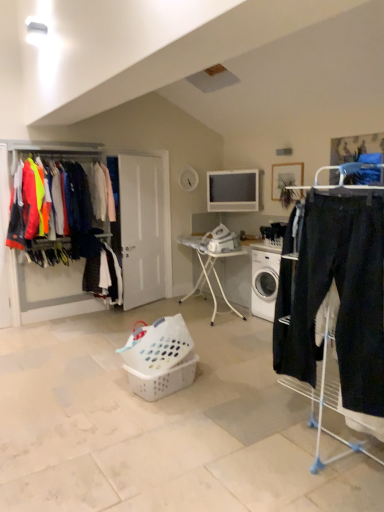
Question: From the image's perspective, relative to wooden picture frame at upper right, is white plastic lampshade at upper center above or below?

Choices:
 (A) below
 (B) above

Answer: (B)

Question: Relative to wooden picture frame at upper right, is white plastic lampshade at upper center in front or behind?

Choices:
 (A) behind
 (B) front

Answer: (B)

Question: Which object is the closest to the white plastic basket at center, positioned as the first basket in bottom-to-top order?

Choices:
 (A) white metal ironing board at center
 (B) dark blue fabric pants at center, which is counted as the 3th clothing, starting from the front
 (C) matte black jacket at left, the 1th clothing when ordered from left to right
 (D) matte gray tv at center
 (E) white plastic lampshade at upper center

Answer: (A)

Question: Estimate the real-world distances between objects in this image. Which object is closer to the matte gray tv at center?

Choices:
 (A) wooden picture frame at upper right
 (B) white plastic laundry basket at center, acting as the first basket starting from the top
 (C) matte black jacket at left, which is counted as the 2th clothing, starting from the front
 (D) dark blue jeans at right, arranged as the first clothing when viewed from the right
 (E) dark blue fabric pants at center, the 2th clothing positioned from the right

Answer: (A)